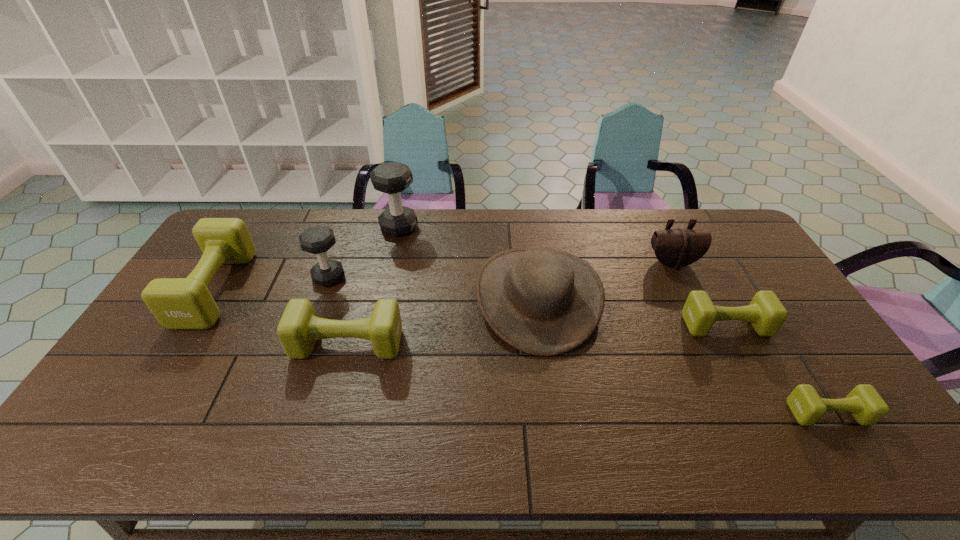
Find the location of a particular element. This screenshot has height=540, width=960. free space at the left edge of the desktop is located at coordinates (163, 353).

In the image, there is a desktop. Where is `vacant space at the right edge`? The height and width of the screenshot is (540, 960). vacant space at the right edge is located at coordinates (789, 376).

Locate an element on the screen. The width and height of the screenshot is (960, 540). free space at the far right corner of the desktop is located at coordinates (717, 244).

The height and width of the screenshot is (540, 960). I want to click on vacant space that's between the bigger gray dumbbell and the biggest olive dumbbell, so click(307, 258).

The image size is (960, 540). I want to click on unoccupied position between the leftmost olive dumbbell and the tallest dumbbell, so click(307, 258).

Image resolution: width=960 pixels, height=540 pixels. Identify the location of free spot between the leftmost object and the farther gray dumbbell. (307, 258).

At what (x,y) coordinates should I click in order to perform the action: click on unoccupied area between the brown pouch and the fifth object from left to right. Please return your answer as a coordinate pair (x, y). Looking at the image, I should click on (605, 280).

Identify the location of empty space between the biggest olive dumbbell and the third olive dumbbell from right to left. The height and width of the screenshot is (540, 960). (281, 316).

Find the location of a particular element. free space between the leftmost dumbbell and the tallest dumbbell is located at coordinates (307, 258).

Locate an element on the screen. object that stands as the seventh closest to the brown pouch is located at coordinates (177, 303).